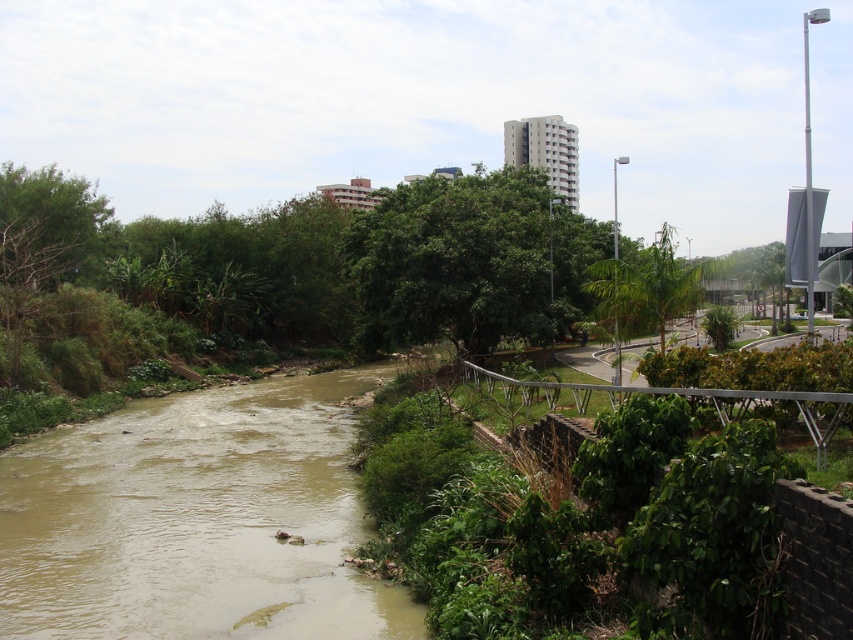
Question: Can you confirm if brown muddy water at center is positioned to the right of green leafy tree at center?

Choices:
 (A) yes
 (B) no

Answer: (B)

Question: Which point is farther to the camera?

Choices:
 (A) green leafy tree at center
 (B) brown muddy water at center

Answer: (A)

Question: Where is brown muddy water at center located in relation to green leafy tree at center in the image?

Choices:
 (A) right
 (B) left

Answer: (B)

Question: Can you confirm if brown muddy water at center is positioned to the left of green leafy tree at center?

Choices:
 (A) no
 (B) yes

Answer: (B)

Question: Which point is farther from the camera taking this photo?

Choices:
 (A) (61, 563)
 (B) (660, 324)

Answer: (B)